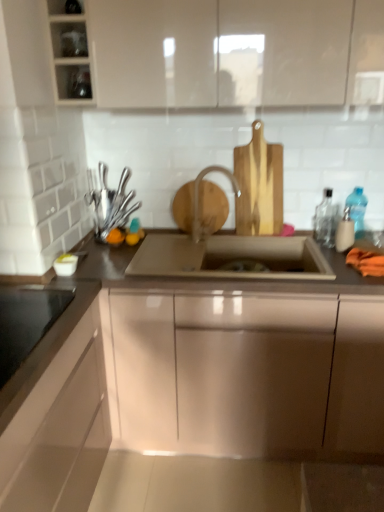
Question: Is glossy metallic sink at center, the 2th cabinetry when ordered from bottom to top, taller than satin nickel faucet at center?

Choices:
 (A) yes
 (B) no

Answer: (A)

Question: From a real-world perspective, is glossy metallic sink at center, the 2th cabinetry when ordered from bottom to top, under satin nickel faucet at center?

Choices:
 (A) yes
 (B) no

Answer: (A)

Question: Considering the relative sizes of glossy metallic sink at center, the 2th cabinetry when ordered from bottom to top, and satin nickel faucet at center in the image provided, is glossy metallic sink at center, the 2th cabinetry when ordered from bottom to top, bigger than satin nickel faucet at center?

Choices:
 (A) no
 (B) yes

Answer: (B)

Question: Is there a large distance between glossy metallic sink at center, which is counted as the second cabinetry, starting from the top, and satin nickel faucet at center?

Choices:
 (A) no
 (B) yes

Answer: (A)

Question: From the image's perspective, is glossy metallic sink at center, which is counted as the second cabinetry, starting from the top, over satin nickel faucet at center?

Choices:
 (A) yes
 (B) no

Answer: (B)

Question: From the image's perspective, is satin nickel sink at center located above or below black glass cooktop at lower left, marked as the second appliance in a back-to-front arrangement?

Choices:
 (A) below
 (B) above

Answer: (B)

Question: Does point (x=231, y=263) appear closer or farther from the camera than point (x=38, y=314)?

Choices:
 (A) closer
 (B) farther

Answer: (B)

Question: Looking at their shapes, would you say satin nickel sink at center is wider or thinner than black glass cooktop at lower left, which appears as the second appliance when viewed from the top?

Choices:
 (A) thin
 (B) wide

Answer: (B)

Question: Is satin nickel sink at center situated inside black glass cooktop at lower left, marked as the second appliance in a back-to-front arrangement, or outside?

Choices:
 (A) inside
 (B) outside

Answer: (B)

Question: Considering their positions, is transparent glass jar at upper left, acting as the 2th shelf starting from the bottom, located in front of or behind black glass cooktop at lower left, arranged as the 1th appliance when ordered from the bottom?

Choices:
 (A) behind
 (B) front

Answer: (A)

Question: From a real-world perspective, relative to black glass cooktop at lower left, arranged as the 1th appliance when ordered from the bottom, is transparent glass jar at upper left, arranged as the first shelf when viewed from the top, vertically above or below?

Choices:
 (A) above
 (B) below

Answer: (A)

Question: Would you say transparent glass jar at upper left, arranged as the first shelf when viewed from the top, is inside or outside black glass cooktop at lower left, marked as the second appliance in a back-to-front arrangement?

Choices:
 (A) inside
 (B) outside

Answer: (B)

Question: Is transparent glass jar at upper left, arranged as the first shelf when viewed from the top, wider or thinner than black glass cooktop at lower left, marked as the second appliance in a back-to-front arrangement?

Choices:
 (A) wide
 (B) thin

Answer: (B)

Question: Considering the positions of transparent glass jar at upper left, arranged as the first shelf when viewed from the top, and transparent plastic bottle at right, the third bottle from the left, in the image, is transparent glass jar at upper left, arranged as the first shelf when viewed from the top, taller or shorter than transparent plastic bottle at right, the third bottle from the left,?

Choices:
 (A) short
 (B) tall

Answer: (A)

Question: Is transparent glass jar at upper left, acting as the 2th shelf starting from the bottom, in front of or behind transparent plastic bottle at right, the third bottle from the left, in the image?

Choices:
 (A) front
 (B) behind

Answer: (A)